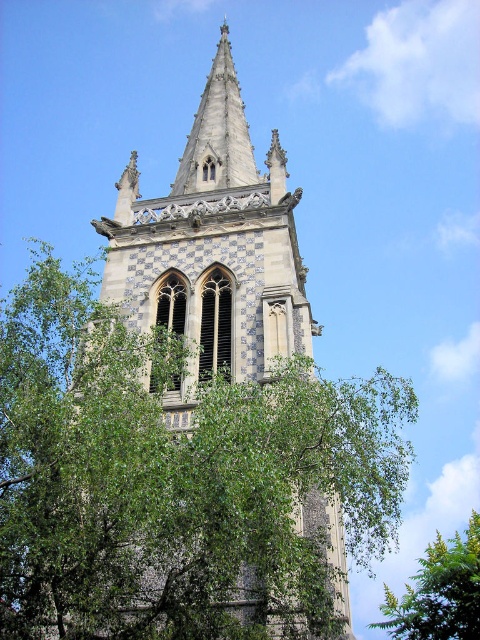
Looking at this image, is white checkered stone tower at center above green leafy tree at lower right?

Yes.

Between white checkered stone tower at center and green leafy tree at lower right, which one appears on the right side from the viewer's perspective?

green leafy tree at lower right

Between point (167, 317) and point (456, 637), which one is positioned in front?

Point (167, 317) is more forward.

You are a GUI agent. You are given a task and a screenshot of the screen. Output one action in this format:
    pyautogui.click(x=<x>, y=<y>)
    Task: Click on the white checkered stone tower at center
    Image resolution: width=480 pixels, height=640 pixels.
    Given the screenshot: What is the action you would take?
    pyautogui.click(x=213, y=250)